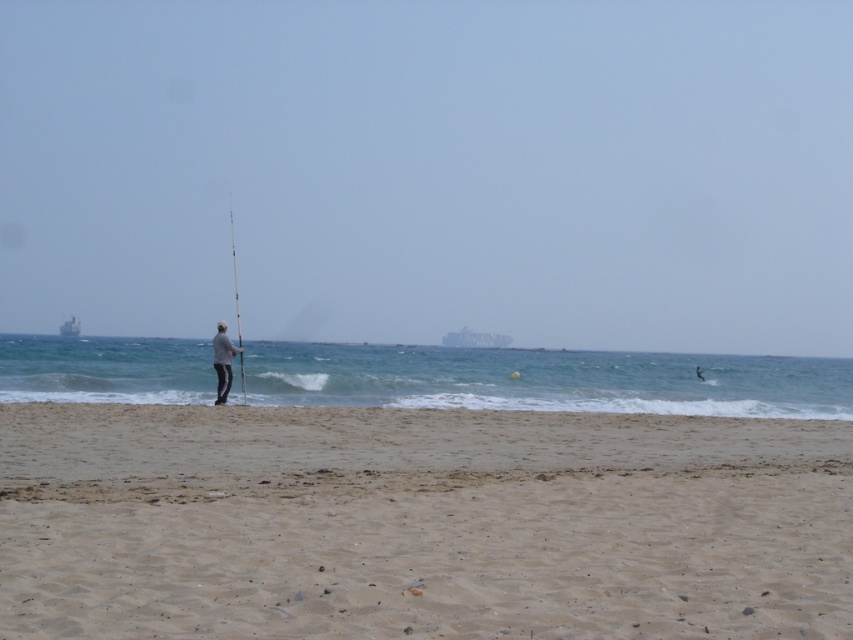
Which of these two, fine-grained sand at lower center or light gray fabric jacket at center, stands shorter?

Standing shorter between the two is fine-grained sand at lower center.

Describe the element at coordinates (419, 524) in the screenshot. The width and height of the screenshot is (853, 640). I see `fine-grained sand at lower center` at that location.

Is point (769, 445) closer to camera compared to point (225, 374)?

Yes, point (769, 445) is closer to viewer.

Where is `fine-grained sand at lower center`? The width and height of the screenshot is (853, 640). fine-grained sand at lower center is located at coordinates (419, 524).

Is point (215, 365) less distant than point (234, 275)?

Yes, it is in front of point (234, 275).

Can you confirm if light gray fabric jacket at center is positioned to the right of smooth black pole at center?

Yes, light gray fabric jacket at center is to the right of smooth black pole at center.

Does point (216, 348) come closer to viewer compared to point (235, 285)?

Yes, point (216, 348) is closer to viewer.

Locate an element on the screen. The width and height of the screenshot is (853, 640). light gray fabric jacket at center is located at coordinates (223, 360).

Who is positioned more to the right, fine-grained sand at lower center or smooth black pole at center?

From the viewer's perspective, fine-grained sand at lower center appears more on the right side.

Which is behind, point (175, 636) or point (231, 252)?

Positioned behind is point (231, 252).

Locate an element on the screen. The width and height of the screenshot is (853, 640). fine-grained sand at lower center is located at coordinates (419, 524).